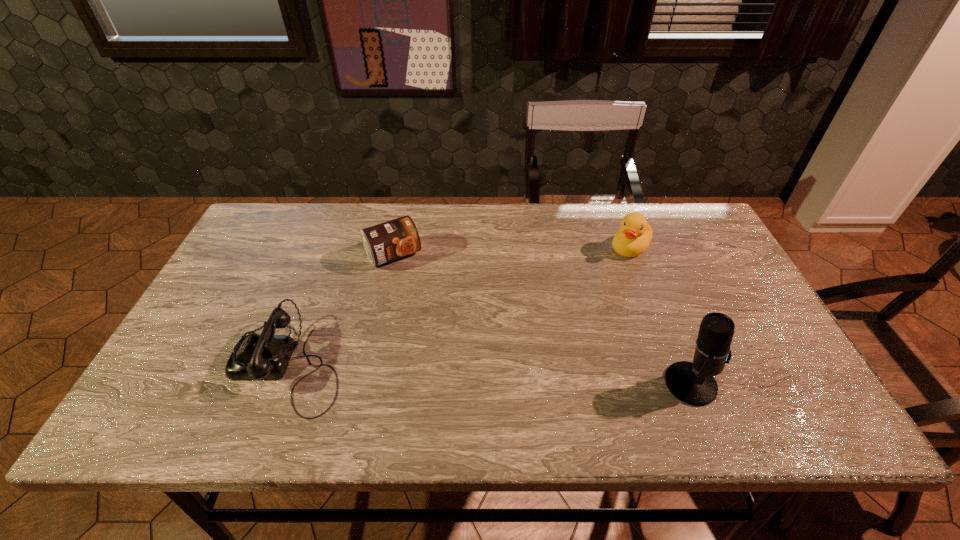
The width and height of the screenshot is (960, 540). In order to click on free space at the near edge in this screenshot , I will do [x=647, y=375].

The image size is (960, 540). In order to click on vacant space at the left edge of the desktop in this screenshot , I will do `click(214, 338)`.

You are a GUI agent. You are given a task and a screenshot of the screen. Output one action in this format:
    pyautogui.click(x=<x>, y=<y>)
    Task: Click on the vacant space at the far left corner of the desktop
    Image resolution: width=960 pixels, height=540 pixels.
    Given the screenshot: What is the action you would take?
    pyautogui.click(x=276, y=210)

Where is `vacant point at the far right corner`? The width and height of the screenshot is (960, 540). vacant point at the far right corner is located at coordinates (701, 242).

This screenshot has height=540, width=960. What are the coordinates of `vacant point located between the third shortest object and the tallest object` in the screenshot? It's located at (660, 316).

At what (x,y) coordinates should I click in order to perform the action: click on empty location between the third shortest object and the can. Please return your answer as a coordinate pair (x, y). Looking at the image, I should click on (512, 252).

At what (x,y) coordinates should I click in order to perform the action: click on free spot between the third shortest object and the microphone. Please return your answer as a coordinate pair (x, y). Looking at the image, I should click on (660, 316).

What are the coordinates of `empty space between the can and the second tallest object` in the screenshot? It's located at (512, 252).

You are a GUI agent. You are given a task and a screenshot of the screen. Output one action in this format:
    pyautogui.click(x=<x>, y=<y>)
    Task: Click on the vacant space in between the second tallest object and the microphone
    
    Given the screenshot: What is the action you would take?
    pyautogui.click(x=660, y=316)

Where is `empty location between the can and the second tallest object`? The image size is (960, 540). empty location between the can and the second tallest object is located at coordinates (512, 252).